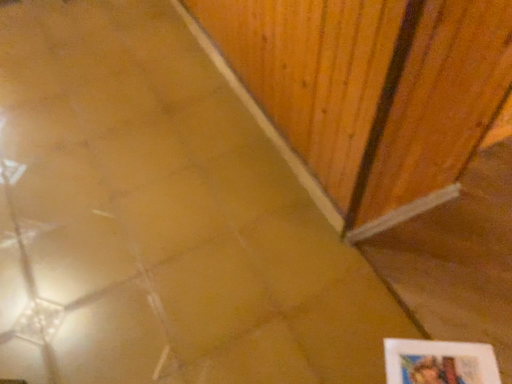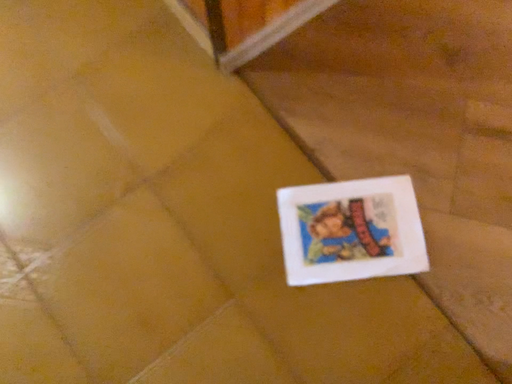
Question: Which way did the camera rotate in the video?

Choices:
 (A) rotated left
 (B) rotated right

Answer: (B)